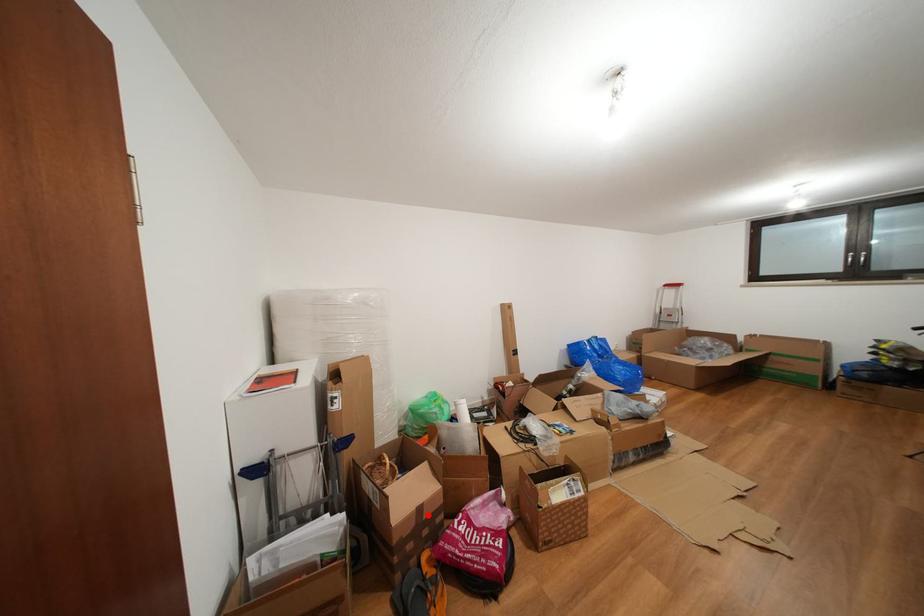
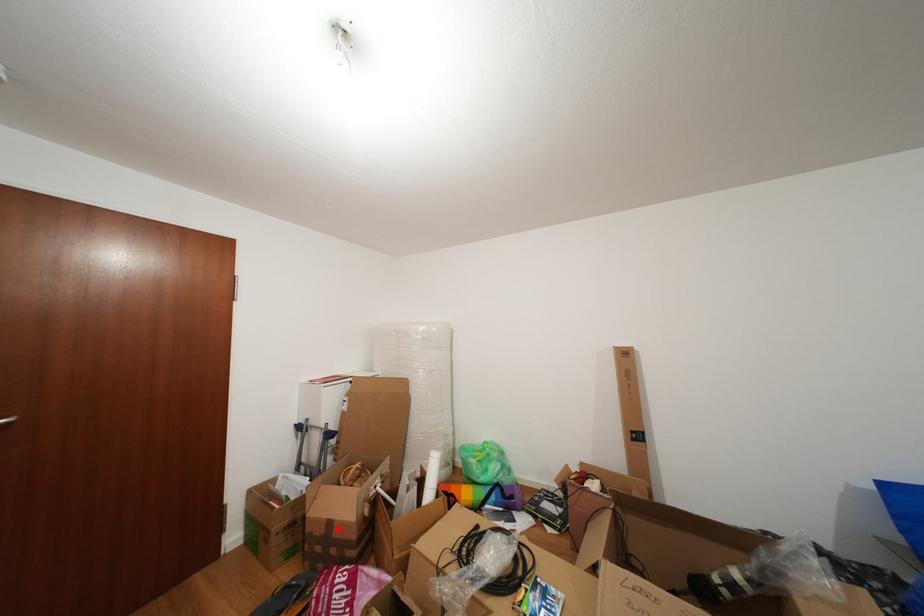
I am providing you with two images of the same scene from different viewpoints. A red point is marked on the first image and another point is marked on the second image. Does the point marked in image1 correspond to the same location as the one in image2?

Yes